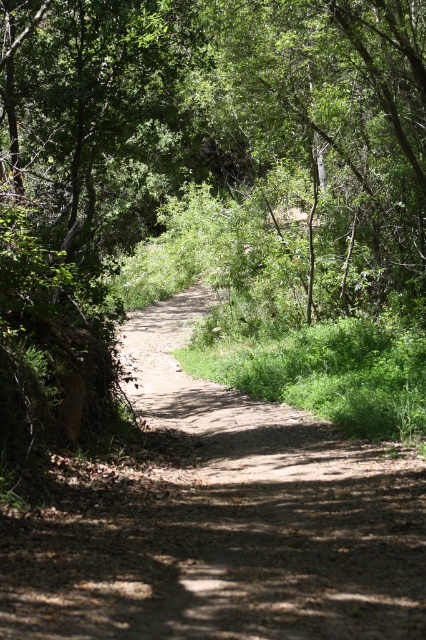
Based on the photo, can you confirm if dirt path at center is positioned below brown dirt track at center?

No, dirt path at center is not below brown dirt track at center.

Who is lower down, dirt path at center or brown dirt track at center?

Positioned lower is brown dirt track at center.

This screenshot has width=426, height=640. What do you see at coordinates (215, 198) in the screenshot?
I see `dirt path at center` at bounding box center [215, 198].

Where is `dirt path at center`? This screenshot has width=426, height=640. dirt path at center is located at coordinates (215, 198).